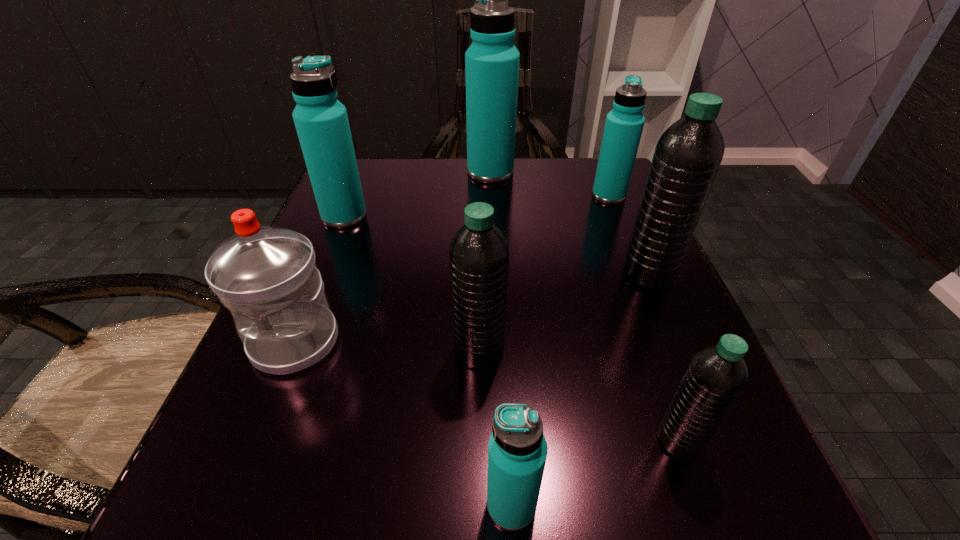
The height and width of the screenshot is (540, 960). In order to click on water bottle that is the sixth closest to the rightmost blue water bottle in this screenshot , I will do `click(267, 276)`.

In order to click on blue water bottle that is the second closest one to the fifth nearest object in this screenshot , I will do `click(492, 61)`.

The height and width of the screenshot is (540, 960). I want to click on blue water bottle that can be found as the third closest to the second farthest black water bottle, so click(624, 124).

Choose which black water bottle is the nearest neighbor to the rightmost blue water bottle. Please provide its 2D coordinates. Your answer should be formatted as a tuple, i.e. [(x, y)], where the tuple contains the x and y coordinates of a point satisfying the conditions above.

[(688, 154)]

This screenshot has height=540, width=960. I want to click on black water bottle identified as the third closest to the white water bottle, so click(688, 154).

I want to click on free space that satisfies the following two spatial constraints: 1. on the handle side of the white water bottle; 2. on the left side of the second smallest black water bottle, so click(292, 350).